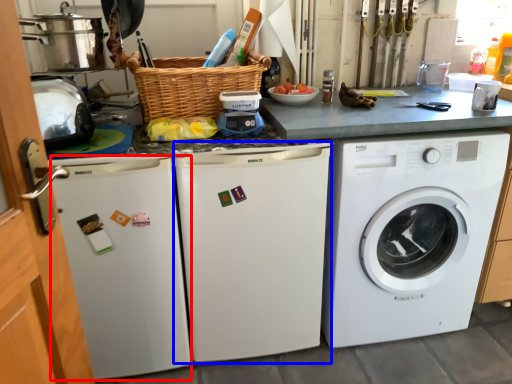
Question: Among these objects, which one is nearest to the camera, dish washer (highlighted by a red box) or dish washer (highlighted by a blue box)?

Choices:
 (A) dish washer
 (B) dish washer

Answer: (A)